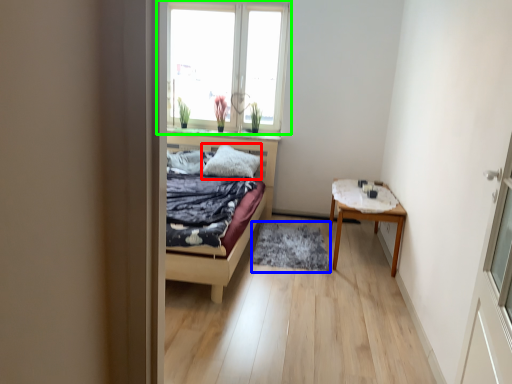
Question: Which object is the closest to the pillow (highlighted by a red box)? Choose among these: mat (highlighted by a blue box) or window (highlighted by a green box).

Choices:
 (A) mat
 (B) window

Answer: (A)